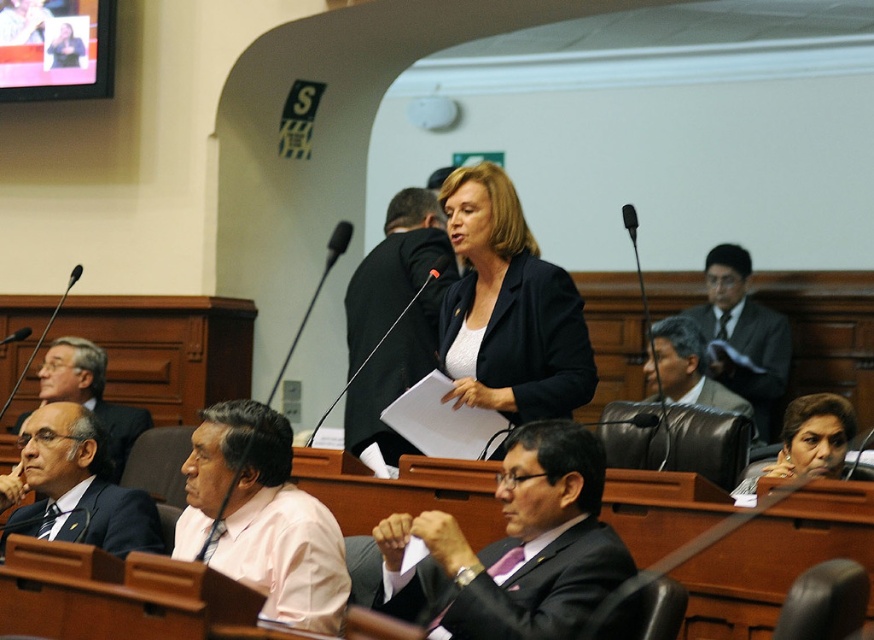
You are attending a meeting and need to identify the person speaking. Which object is closer to the podium? The matte black suit at center or the matte black hair at center?

The matte black suit at center is located below the matte black hair at center, so the matte black suit at center is closer to the podium since it is lower in position.

You are attending a formal meeting and need to locate two specific points marked in the room. The first point is at coordinate point (73, 515) and the second is at point (803, 461). From your perspective facing the front of the room, which point is closer to the entrance?

Point (73, 515) is in front of point (803, 461), so it is closer to the entrance.

In the formal assembly scene, there is a dark suit at left and a matte black hair at center. Which object is taller?

The dark suit at left is taller than the matte black hair at center.